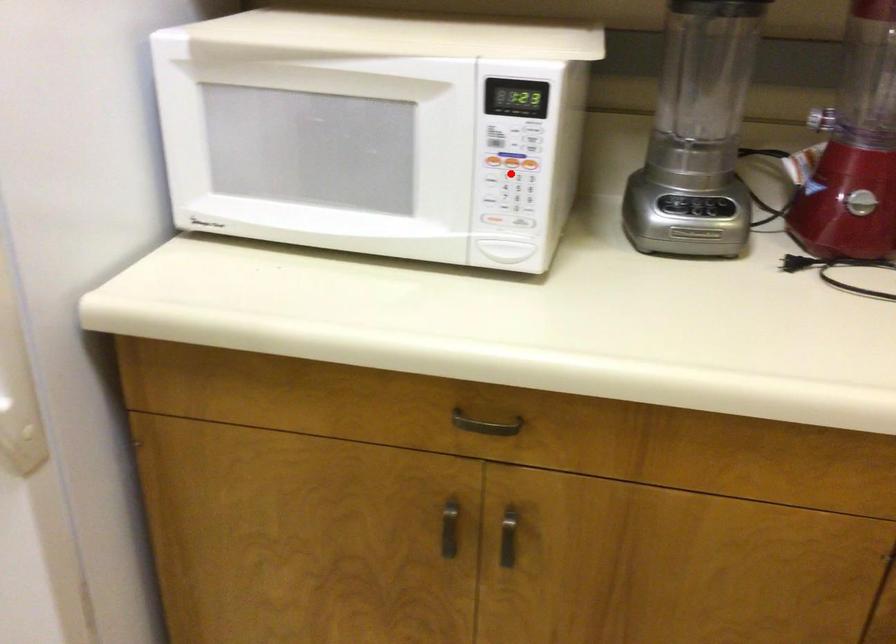
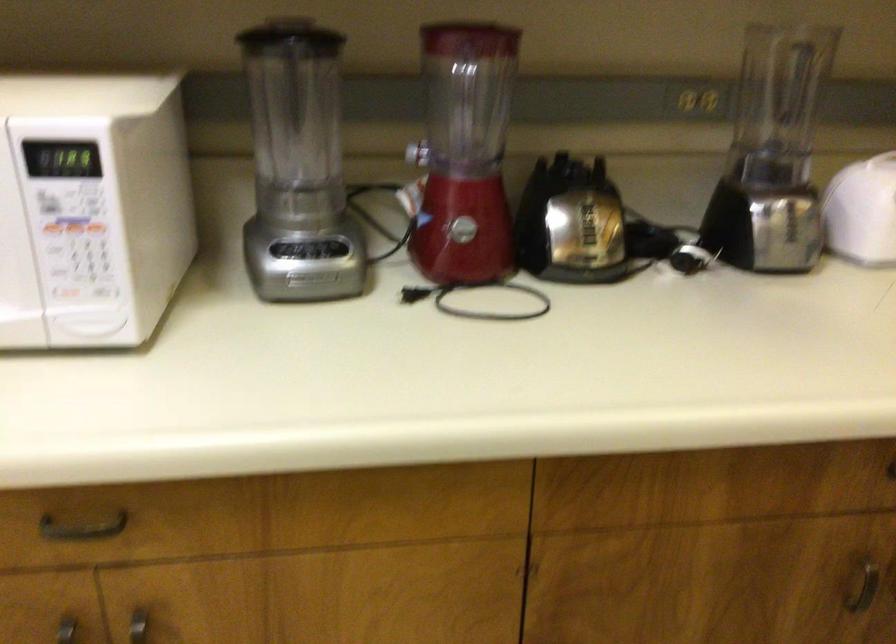
Question: I am providing you with two images of the same scene from different viewpoints. Image1 has a red point marked. In image2, the corresponding 3D location appears at what relative position? Reply with the corresponding letter.

Choices:
 (A) Closer
 (B) Farther

Answer: (A)